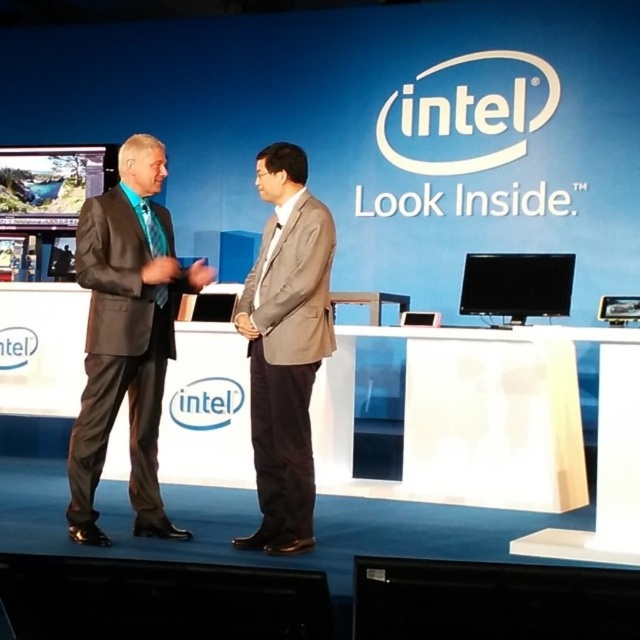
You are standing in front of the Intel stage at the promotional event. There are two points marked on the stage floor. The first point is at coordinates point (118, 248) and the second is at point (253, 435). Which point is closer to you?

Point (118, 248) is closer to the viewer than point (253, 435).

You are attending an Intel promotional event and notice two suits worn by the speakers. The matte black suit at left and the light brown fabric suit at center. Which one is located to the left of the other?

The matte black suit at left is positioned on the left side of the light brown fabric suit at center.